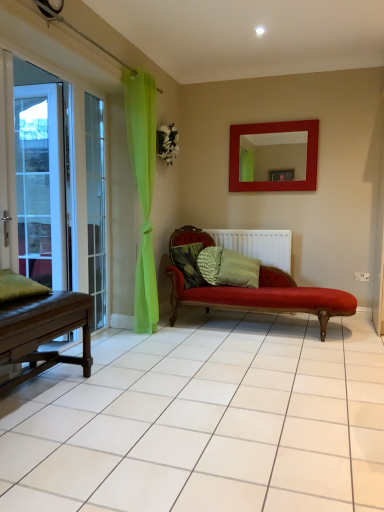
Question: Considering the relative sizes of matte red mirror at upper center and green fabric pillow at left, placed as the first pillow when sorted from front to back, in the image provided, is matte red mirror at upper center wider than green fabric pillow at left, placed as the first pillow when sorted from front to back,?

Choices:
 (A) no
 (B) yes

Answer: (A)

Question: Can you confirm if matte red mirror at upper center is taller than green fabric pillow at left, placed as the first pillow when sorted from front to back?

Choices:
 (A) no
 (B) yes

Answer: (B)

Question: Can you confirm if matte red mirror at upper center is smaller than green fabric pillow at left, which is the 4th pillow from right to left?

Choices:
 (A) no
 (B) yes

Answer: (A)

Question: Are matte red mirror at upper center and green fabric pillow at left, placed as the first pillow when sorted from front to back, far apart?

Choices:
 (A) yes
 (B) no

Answer: (A)

Question: Is matte red mirror at upper center looking in the opposite direction of green fabric pillow at left, placed as the first pillow when sorted from front to back?

Choices:
 (A) no
 (B) yes

Answer: (A)

Question: Is matte red mirror at upper center shorter than green fabric pillow at left, placed as the fourth pillow when sorted from back to front?

Choices:
 (A) no
 (B) yes

Answer: (A)

Question: Is clear glass door at left taller than green fabric pillow at left, placed as the first pillow when sorted from front to back?

Choices:
 (A) yes
 (B) no

Answer: (A)

Question: Does clear glass door at left come behind green fabric pillow at left, which is the 4th pillow from right to left?

Choices:
 (A) yes
 (B) no

Answer: (A)

Question: Is clear glass door at left thinner than green fabric pillow at left, which is the 4th pillow from right to left?

Choices:
 (A) yes
 (B) no

Answer: (A)

Question: Is clear glass door at left in front of green fabric pillow at left, which is the 4th pillow from right to left?

Choices:
 (A) no
 (B) yes

Answer: (A)

Question: Is clear glass door at left looking in the opposite direction of green fabric pillow at left, marked as the first pillow in a left-to-right arrangement?

Choices:
 (A) no
 (B) yes

Answer: (A)

Question: Considering the relative positions of clear glass door at left and green fabric pillow at left, placed as the first pillow when sorted from front to back, in the image provided, is clear glass door at left to the right of green fabric pillow at left, placed as the first pillow when sorted from front to back, from the viewer's perspective?

Choices:
 (A) yes
 (B) no

Answer: (A)

Question: From the image's perspective, is textured green pillow at center, which is the fourth pillow from front to back, beneath green fabric pillow at left, placed as the first pillow when sorted from front to back?

Choices:
 (A) no
 (B) yes

Answer: (A)